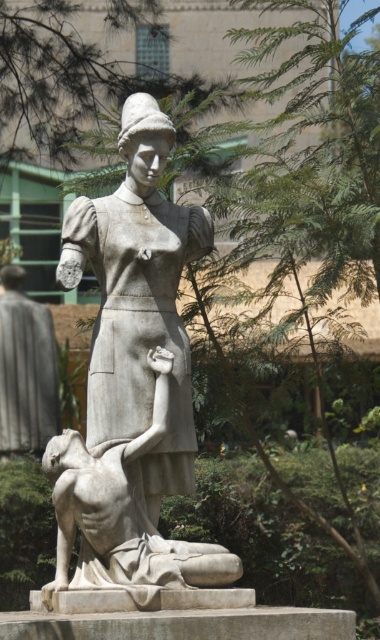
You are an art conservator examining the garden statues. You notice two statues at the center. Which statue, the matte gray statue at center or the white marble statue at center, is placed higher than the other?

The matte gray statue at center is positioned over the white marble statue at center, so it is higher.

You are a photographer standing at a certain distance from the matte gray statue at center. You want to capture a photo where the statue fills the frame without being too close to avoid blurring. Given that the statue is 2 meters tall, what is the minimum distance you should maintain to ensure the statue occupies exactly 50 percent of the frame height?

The minimum distance should be 2 meters divided by 0.5, which equals 4 meters. However, the statue is already 65.97 meters away from the camera, so maintaining that distance would be sufficient as it already exceeds the required 4 meters.

You are an artist trying to sketch the statue from the front. You notice two specific points on the statue marked as point 1 at coordinates point [85,250] and point 2 at coordinates point [142,499]. Which point should you focus on first if you want to start drawing the part of the statue closest to you?

Point [85,250] is closer to the viewer than point [142,499], so you should focus on point [85,250] first.